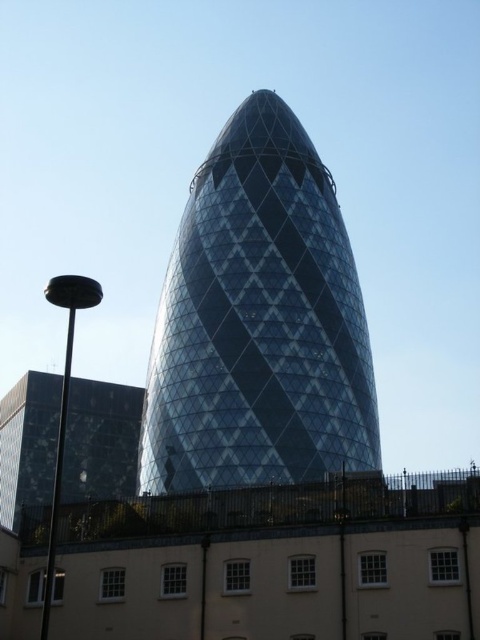
You are standing in front of the transparent glass tower at center. You want to take a photo that captures the entire structure without any distortion. Considering the camera requires a minimum distance of 60 meters to avoid distortion, can you take the photo from your current position?

The distance between you and the transparent glass tower at center is 69.01 meters, which exceeds the minimum required 60 meters. Therefore, you can take the photo from your current position without distortion.

You are a tourist standing in front of the Gherkin and want to take a photo that includes both the transparent glass tower at center and the glassy reflective building at lower left. Which building should you frame first in your camera to ensure both are visible?

The transparent glass tower at center is bigger than the glassy reflective building at lower left, so you should frame the larger transparent glass tower at center first to ensure both are visible in the photo.

Consider the image. Based on the scene description, what are the coordinates of the transparent glass tower at center?

The transparent glass tower at center is located at coordinates point (x=259, y=321).